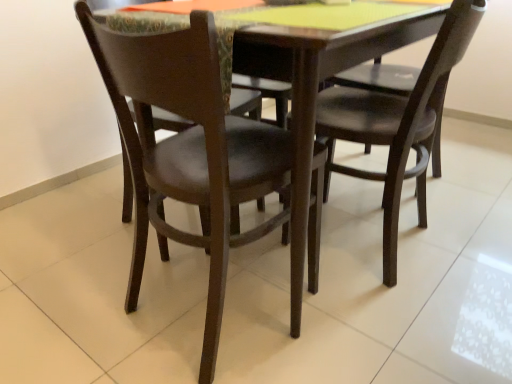
Image resolution: width=512 pixels, height=384 pixels. I want to click on matte dark brown chair at center, arranged as the 2th chair when viewed from the right, so click(189, 149).

The height and width of the screenshot is (384, 512). What do you see at coordinates (189, 149) in the screenshot?
I see `matte dark brown chair at center, marked as the 1th chair in a left-to-right arrangement` at bounding box center [189, 149].

How much space does matte dark brown chair at center, marked as the 1th chair in a left-to-right arrangement, occupy vertically?

31.77 inches.

What do you see at coordinates (399, 123) in the screenshot? The width and height of the screenshot is (512, 384). I see `matte black chair at center, which ranks as the second chair in left-to-right order` at bounding box center [399, 123].

Identify the location of matte black chair at center, the first chair in the right-to-left sequence. click(x=399, y=123).

Identify the location of matte dark brown chair at center, marked as the 1th chair in a left-to-right arrangement. This screenshot has width=512, height=384. (189, 149).

Considering the relative positions of matte dark brown chair at center, arranged as the 2th chair when viewed from the right, and matte black chair at center, the first chair in the right-to-left sequence, in the image provided, is matte dark brown chair at center, arranged as the 2th chair when viewed from the right, to the right of matte black chair at center, the first chair in the right-to-left sequence, from the viewer's perspective?

Incorrect, matte dark brown chair at center, arranged as the 2th chair when viewed from the right, is not on the right side of matte black chair at center, the first chair in the right-to-left sequence.

Is matte dark brown chair at center, arranged as the 2th chair when viewed from the right, further to camera compared to matte black chair at center, the first chair in the right-to-left sequence?

No, matte dark brown chair at center, arranged as the 2th chair when viewed from the right, is in front of matte black chair at center, the first chair in the right-to-left sequence.

Based on the photo, which is closer to the camera, [214,177] or [419,208]?

Positioned in front is point [214,177].

From the image's perspective, relative to matte black chair at center, which ranks as the second chair in left-to-right order, is matte dark brown chair at center, arranged as the 2th chair when viewed from the right, above or below?

matte dark brown chair at center, arranged as the 2th chair when viewed from the right, is below matte black chair at center, which ranks as the second chair in left-to-right order.

From a real-world perspective, is matte dark brown chair at center, arranged as the 2th chair when viewed from the right, below matte black chair at center, the first chair in the right-to-left sequence?

Yes, from a real-world perspective, matte dark brown chair at center, arranged as the 2th chair when viewed from the right, is under matte black chair at center, the first chair in the right-to-left sequence.

Is matte dark brown chair at center, marked as the 1th chair in a left-to-right arrangement, wider than matte black chair at center, the first chair in the right-to-left sequence?

Yes.

Considering the relative sizes of matte dark brown chair at center, marked as the 1th chair in a left-to-right arrangement, and matte black chair at center, the first chair in the right-to-left sequence, in the image provided, is matte dark brown chair at center, marked as the 1th chair in a left-to-right arrangement, taller than matte black chair at center, the first chair in the right-to-left sequence,?

Yes.

Can you confirm if matte dark brown chair at center, marked as the 1th chair in a left-to-right arrangement, is bigger than matte black chair at center, the first chair in the right-to-left sequence?

No.

Is matte black chair at center, which ranks as the second chair in left-to-right order, inside matte dark brown chair at center, marked as the 1th chair in a left-to-right arrangement?

Definitely not — matte black chair at center, which ranks as the second chair in left-to-right order, is not inside matte dark brown chair at center, marked as the 1th chair in a left-to-right arrangement.

Is matte dark brown chair at center, arranged as the 2th chair when viewed from the right, far from matte black chair at center, the first chair in the right-to-left sequence?

matte dark brown chair at center, arranged as the 2th chair when viewed from the right, is near matte black chair at center, the first chair in the right-to-left sequence, not far away.

Is matte dark brown chair at center, arranged as the 2th chair when viewed from the right, positioned with its back to matte black chair at center, which ranks as the second chair in left-to-right order?

No.

Looking at this image, how many degrees apart are the facing directions of matte dark brown chair at center, arranged as the 2th chair when viewed from the right, and matte black chair at center, the first chair in the right-to-left sequence?

The angle between the facing direction of matte dark brown chair at center, arranged as the 2th chair when viewed from the right, and the facing direction of matte black chair at center, the first chair in the right-to-left sequence, is 102 degrees.

Measure the distance between matte dark brown chair at center, marked as the 1th chair in a left-to-right arrangement, and matte black chair at center, which ranks as the second chair in left-to-right order.

matte dark brown chair at center, marked as the 1th chair in a left-to-right arrangement, is 35.62 centimeters away from matte black chair at center, which ranks as the second chair in left-to-right order.

Identify the location of chair below the matte black chair at center, the first chair in the right-to-left sequence (from the image's perspective). This screenshot has height=384, width=512. (189, 149).

Is matte black chair at center, which ranks as the second chair in left-to-right order, at the right side of matte dark brown chair at center, arranged as the 2th chair when viewed from the right?

Correct, you'll find matte black chair at center, which ranks as the second chair in left-to-right order, to the right of matte dark brown chair at center, arranged as the 2th chair when viewed from the right.

Which object is further away from the camera taking this photo, matte black chair at center, which ranks as the second chair in left-to-right order, or matte dark brown chair at center, marked as the 1th chair in a left-to-right arrangement?

matte black chair at center, which ranks as the second chair in left-to-right order, is further from the camera.

Considering the positions of point (372, 142) and point (193, 86), is point (372, 142) closer or farther from the camera than point (193, 86)?

Point (372, 142).

From the picture: From the image's perspective, is matte black chair at center, the first chair in the right-to-left sequence, above or below matte dark brown chair at center, marked as the 1th chair in a left-to-right arrangement?

matte black chair at center, the first chair in the right-to-left sequence, is situated higher than matte dark brown chair at center, marked as the 1th chair in a left-to-right arrangement, in the image.

From a real-world perspective, who is located higher, matte black chair at center, which ranks as the second chair in left-to-right order, or matte dark brown chair at center, marked as the 1th chair in a left-to-right arrangement?

matte black chair at center, which ranks as the second chair in left-to-right order, from a real-world perspective.

Does matte black chair at center, the first chair in the right-to-left sequence, have a greater width compared to matte dark brown chair at center, arranged as the 2th chair when viewed from the right?

No, matte black chair at center, the first chair in the right-to-left sequence, is not wider than matte dark brown chair at center, arranged as the 2th chair when viewed from the right.

Considering the sizes of objects matte black chair at center, which ranks as the second chair in left-to-right order, and matte dark brown chair at center, marked as the 1th chair in a left-to-right arrangement, in the image provided, who is taller, matte black chair at center, which ranks as the second chair in left-to-right order, or matte dark brown chair at center, marked as the 1th chair in a left-to-right arrangement,?

matte dark brown chair at center, marked as the 1th chair in a left-to-right arrangement.

Does matte black chair at center, which ranks as the second chair in left-to-right order, have a larger size compared to matte dark brown chair at center, marked as the 1th chair in a left-to-right arrangement?

Yes.

Is matte black chair at center, which ranks as the second chair in left-to-right order, inside or outside of matte dark brown chair at center, arranged as the 2th chair when viewed from the right?

matte black chair at center, which ranks as the second chair in left-to-right order, is spatially situated outside matte dark brown chair at center, arranged as the 2th chair when viewed from the right.

In the scene shown: Is matte black chair at center, the first chair in the right-to-left sequence, next to matte dark brown chair at center, marked as the 1th chair in a left-to-right arrangement, and touching it?

No, matte black chair at center, the first chair in the right-to-left sequence, is not in contact with matte dark brown chair at center, marked as the 1th chair in a left-to-right arrangement.

Could you tell me if matte black chair at center, which ranks as the second chair in left-to-right order, is turned towards matte dark brown chair at center, marked as the 1th chair in a left-to-right arrangement?

No, matte black chair at center, which ranks as the second chair in left-to-right order, is not facing towards matte dark brown chair at center, marked as the 1th chair in a left-to-right arrangement.

In the scene shown: How many degrees apart are the facing directions of matte black chair at center, which ranks as the second chair in left-to-right order, and matte dark brown chair at center, marked as the 1th chair in a left-to-right arrangement?

102 degrees.

You are a GUI agent. You are given a task and a screenshot of the screen. Output one action in this format:
    pyautogui.click(x=<x>, y=<y>)
    Task: Click on the chair that is in front of the matte black chair at center, the first chair in the right-to-left sequence
    This screenshot has height=384, width=512.
    Given the screenshot: What is the action you would take?
    pyautogui.click(x=189, y=149)

Where is `chair directly beneath the matte black chair at center, the first chair in the right-to-left sequence (from a real-world perspective)`? This screenshot has width=512, height=384. chair directly beneath the matte black chair at center, the first chair in the right-to-left sequence (from a real-world perspective) is located at coordinates (189, 149).

What are the coordinates of `chair above the matte dark brown chair at center, marked as the 1th chair in a left-to-right arrangement (from a real-world perspective)` in the screenshot? It's located at (399, 123).